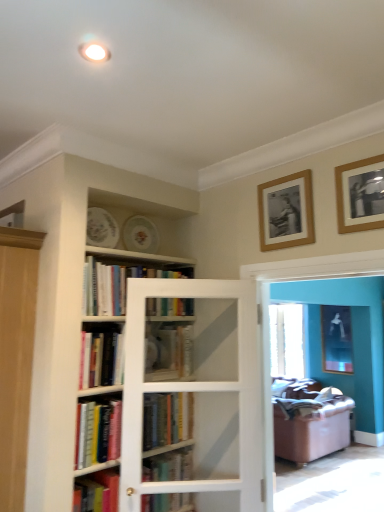
Question: Considering the relative sizes of hardcover books at upper center, which is the 1th book from top to bottom, and hardcover book at center, the sixth book from the top, in the image provided, is hardcover books at upper center, which is the 1th book from top to bottom, wider than hardcover book at center, the sixth book from the top,?

Choices:
 (A) no
 (B) yes

Answer: (A)

Question: From a real-world perspective, is hardcover books at upper center, which is counted as the sixth book, starting from the bottom, located higher than hardcover book at center, the sixth book from the top?

Choices:
 (A) no
 (B) yes

Answer: (B)

Question: From the image's perspective, is hardcover books at upper center, which is the 1th book from top to bottom, below hardcover book at center, which is counted as the first book, starting from the bottom?

Choices:
 (A) no
 (B) yes

Answer: (A)

Question: Is hardcover books at upper center, which is the 1th book from top to bottom, thinner than hardcover book at center, the sixth book from the top?

Choices:
 (A) yes
 (B) no

Answer: (A)

Question: Considering the relative sizes of hardcover books at upper center, which is the 1th book from top to bottom, and hardcover book at center, which is counted as the first book, starting from the bottom, in the image provided, is hardcover books at upper center, which is the 1th book from top to bottom, smaller than hardcover book at center, which is counted as the first book, starting from the bottom,?

Choices:
 (A) no
 (B) yes

Answer: (A)

Question: Is point (177, 478) closer or farther from the camera than point (145, 424)?

Choices:
 (A) closer
 (B) farther

Answer: (B)

Question: Is hardcover book at center, the sixth book from the top, spatially inside hardcover book at center, the 2th book positioned from the bottom, or outside of it?

Choices:
 (A) outside
 (B) inside

Answer: (A)

Question: From the image's perspective, relative to hardcover book at center, which is the 5th book from top to bottom, is hardcover book at center, the sixth book from the top, above or below?

Choices:
 (A) above
 (B) below

Answer: (B)

Question: Is hardcover book at center, the sixth book from the top, taller or shorter than hardcover book at center, which is the 5th book from top to bottom?

Choices:
 (A) tall
 (B) short

Answer: (A)

Question: From the image's perspective, is hardcover books at upper center, which is counted as the sixth book, starting from the bottom, located above or below wooden picture frame at upper right, which is the 2th picture frame in right-to-left order?

Choices:
 (A) above
 (B) below

Answer: (B)

Question: Looking at the image, does hardcover books at upper center, which is counted as the sixth book, starting from the bottom, seem bigger or smaller compared to wooden picture frame at upper right, arranged as the third picture frame when viewed from the back?

Choices:
 (A) small
 (B) big

Answer: (B)

Question: Considering the positions of point (119, 293) and point (367, 201), is point (119, 293) closer or farther from the camera than point (367, 201)?

Choices:
 (A) farther
 (B) closer

Answer: (A)

Question: Is hardcover books at upper center, which is counted as the sixth book, starting from the bottom, in front of or behind wooden picture frame at upper right, acting as the first picture frame starting from the top, in the image?

Choices:
 (A) front
 (B) behind

Answer: (B)

Question: From a real-world perspective, is matte black picture frame at upper right, which ranks as the 3th picture frame in left-to-right order, physically located above or below hardcover book at center, the 3th book positioned from the top?

Choices:
 (A) above
 (B) below

Answer: (B)

Question: In the image, is matte black picture frame at upper right, acting as the 1th picture frame starting from the right, on the left side or the right side of hardcover book at center, the 3th book positioned from the top?

Choices:
 (A) right
 (B) left

Answer: (A)